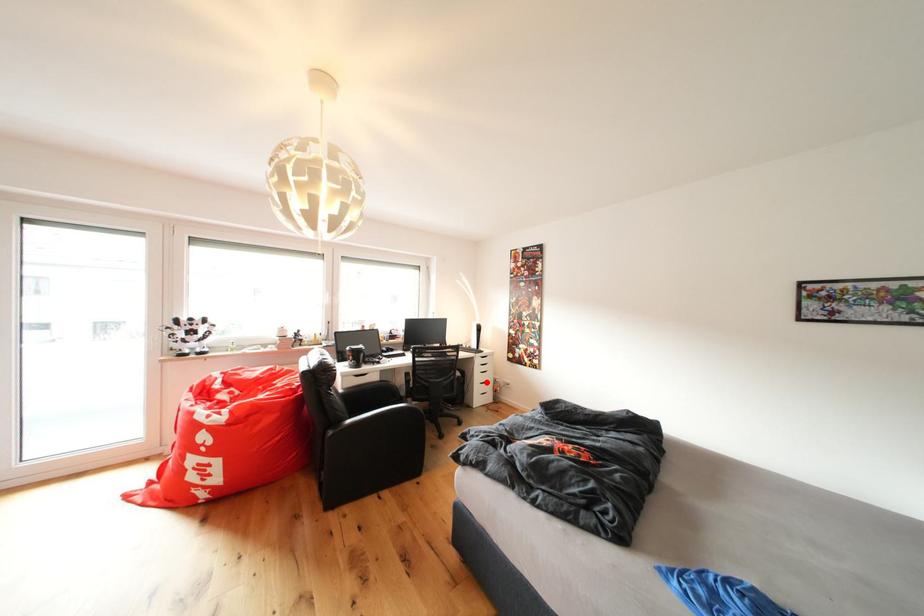
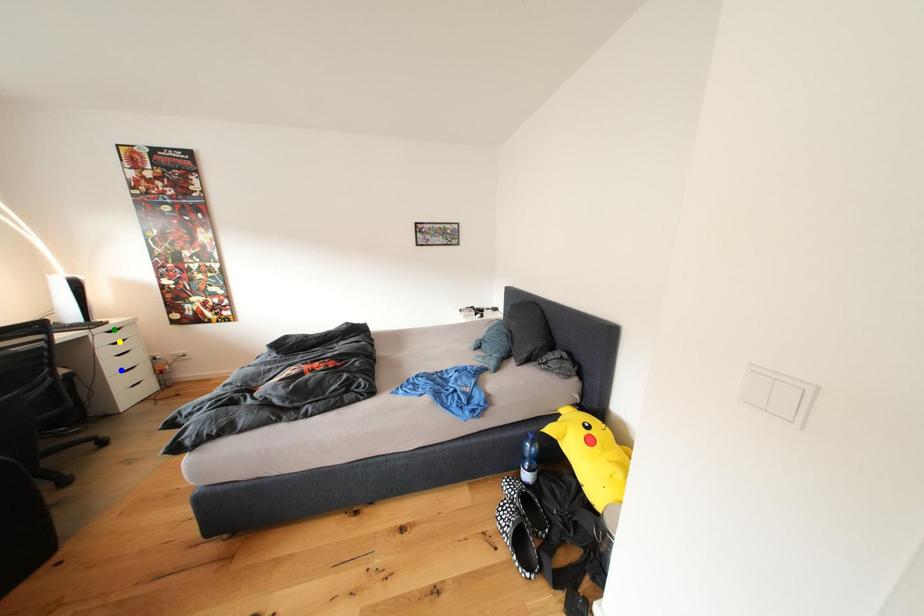
Question: I am providing you with two images of the same scene from different viewpoints. A red point is marked on the first image. You are given multiple points on the second image. In image 2, which mark is for the same physical point as the one in image 1?

Choices:
 (A) green point
 (B) blue point
 (C) yellow point

Answer: (B)